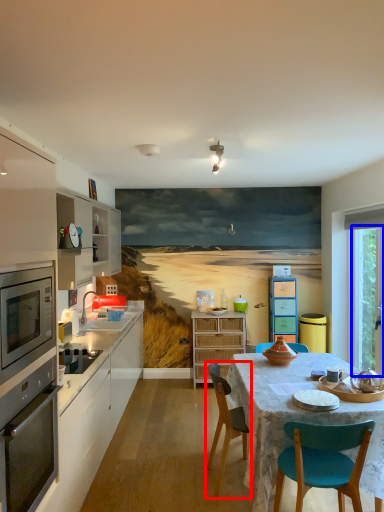
Question: Which point is closer to the camera, chair (highlighted by a red box) or window screen (highlighted by a blue box)?

Choices:
 (A) chair
 (B) window screen

Answer: (A)